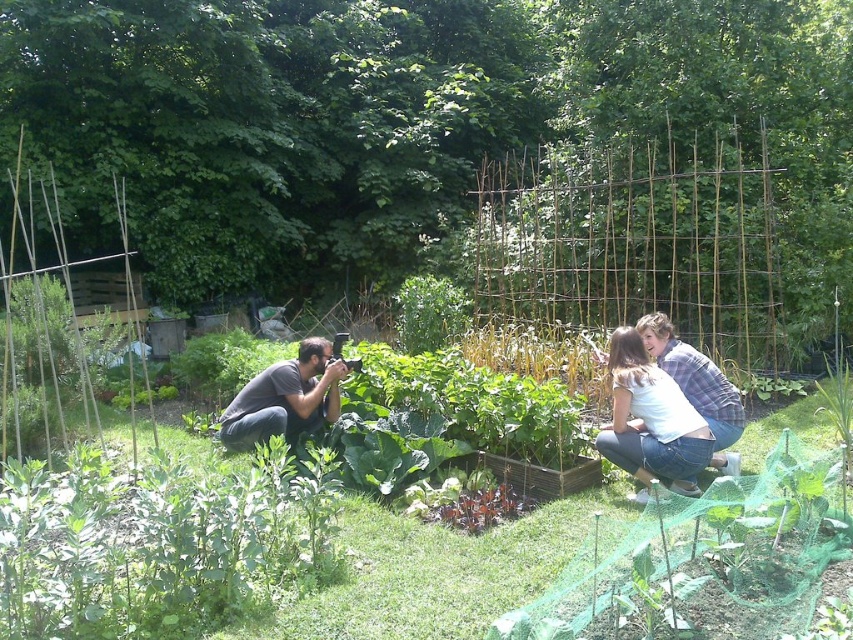
Is matte gray shirt at lower left shorter than white cotton shirt at center?

Indeed, matte gray shirt at lower left has a lesser height compared to white cotton shirt at center.

Can you confirm if matte gray shirt at lower left is positioned to the right of white cotton shirt at center?

In fact, matte gray shirt at lower left is to the left of white cotton shirt at center.

This screenshot has height=640, width=853. Describe the element at coordinates (285, 397) in the screenshot. I see `matte gray shirt at lower left` at that location.

I want to click on matte gray shirt at lower left, so click(x=285, y=397).